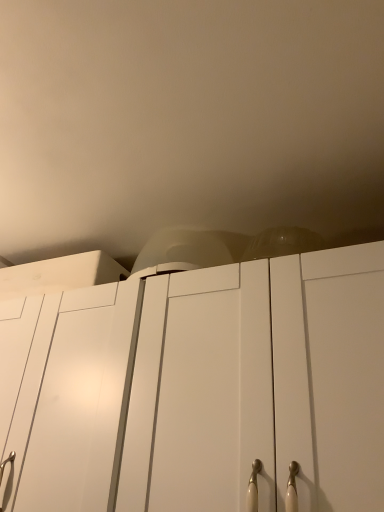
Where is `white matte cabinet at center`? white matte cabinet at center is located at coordinates [x=210, y=389].

Describe the element at coordinates (210, 389) in the screenshot. I see `white matte cabinet at center` at that location.

In order to click on white matte cabinet at center in this screenshot , I will do `click(210, 389)`.